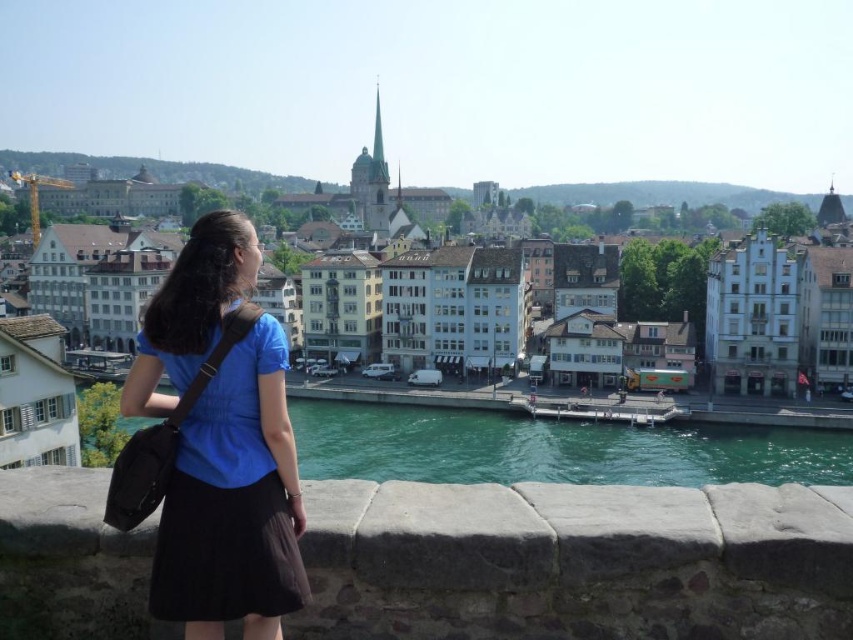
Question: Which object is positioned farthest from the white stone buildings at center?

Choices:
 (A) teal glossy water at center
 (B) blue fabric shirt at center

Answer: (B)

Question: Which of the following is the farthest from the observer?

Choices:
 (A) (845, 477)
 (B) (173, 480)

Answer: (A)

Question: Among these objects, which one is nearest to the camera?

Choices:
 (A) blue fabric shirt at center
 (B) teal glossy water at center
 (C) white stone buildings at center

Answer: (A)

Question: Does blue fabric shirt at center appear over white stone buildings at center?

Choices:
 (A) no
 (B) yes

Answer: (A)

Question: Can you confirm if blue fabric shirt at center is wider than teal glossy water at center?

Choices:
 (A) no
 (B) yes

Answer: (A)

Question: Can you confirm if blue fabric shirt at center is thinner than white stone buildings at center?

Choices:
 (A) yes
 (B) no

Answer: (A)